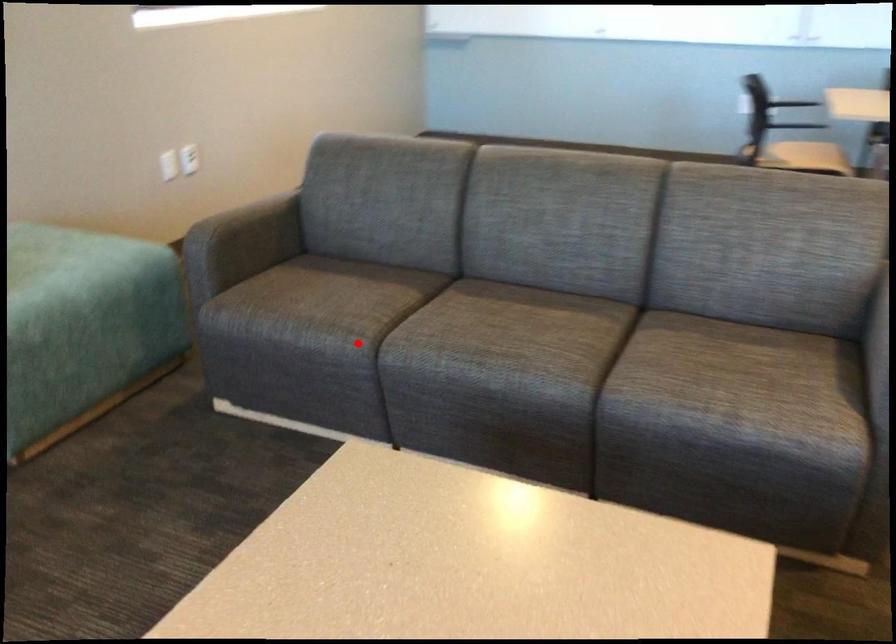
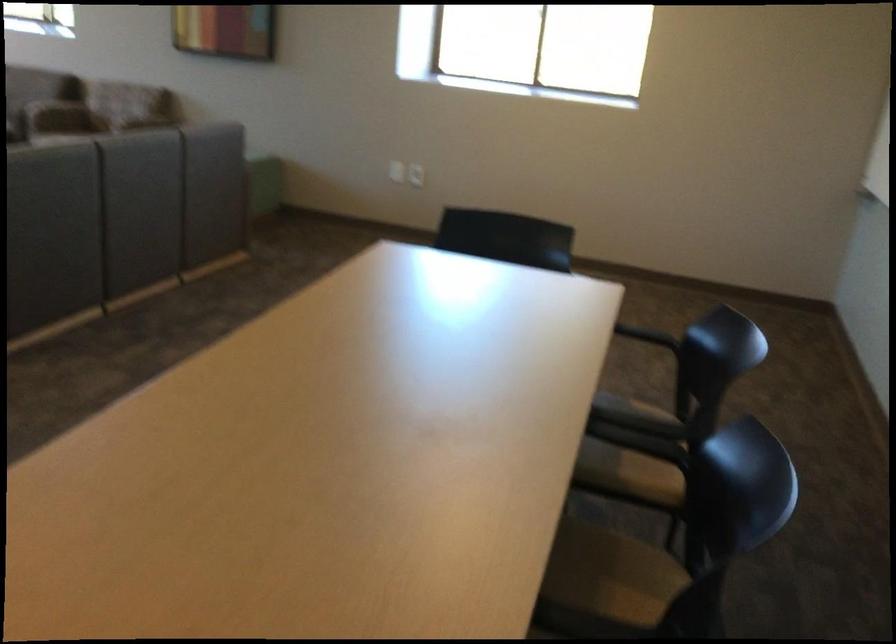
Question: I am providing you with two images of the same scene from different viewpoints. A red point is marked on the first image. At the location where the point appears in image 1, is it still visible in image 2?

Choices:
 (A) Yes
 (B) No

Answer: (B)